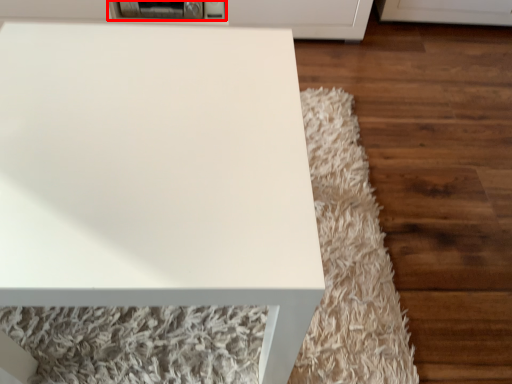
Question: From the image's perspective, where is appliance (annotated by the red box) located relative to table?

Choices:
 (A) below
 (B) above

Answer: (B)